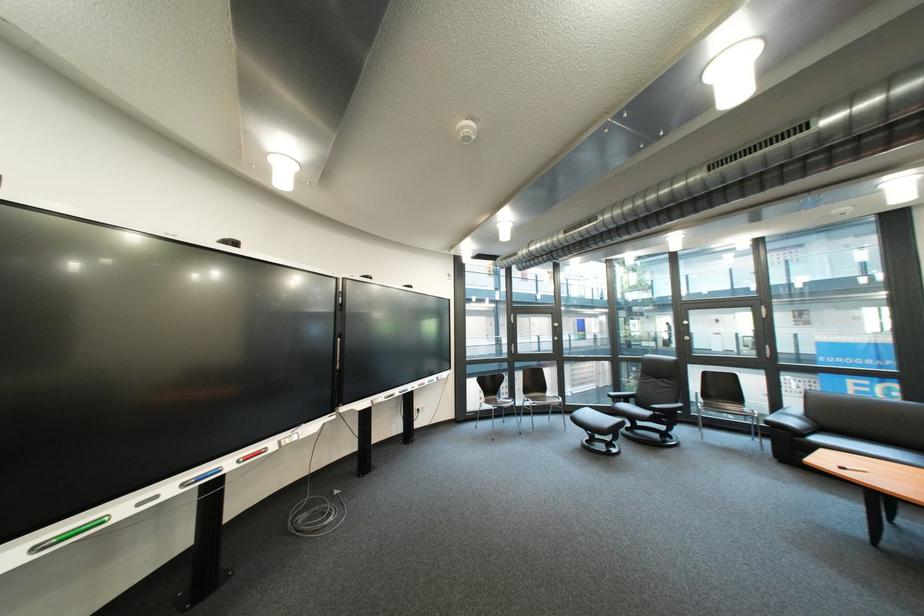
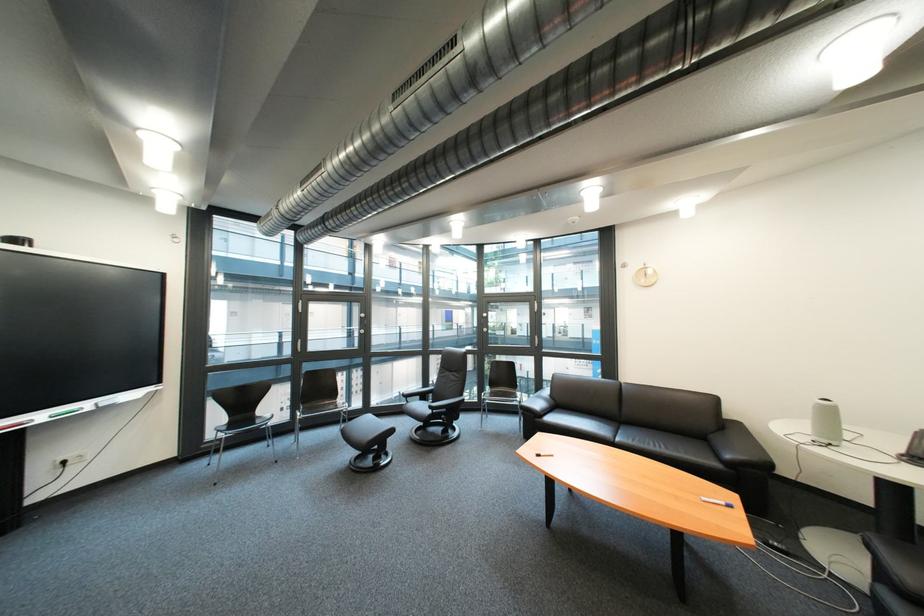
Find the pixel in the second image that matches [447,379] in the first image.

(101, 406)